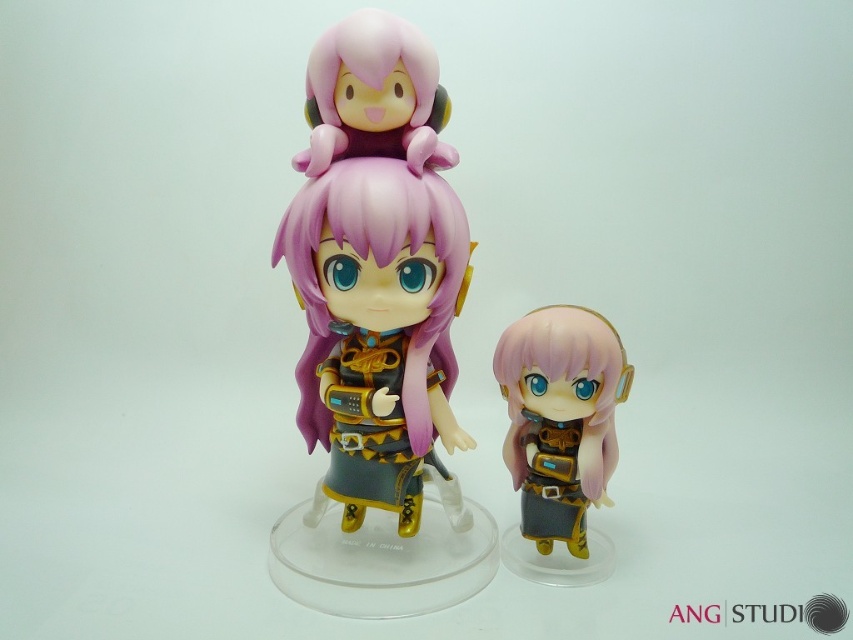
Does matte black figure at center have a greater width compared to purple matte hair at center?

Incorrect, matte black figure at center's width does not surpass purple matte hair at center's.

Between point (627, 380) and point (386, 227), which one is positioned behind?

The point (627, 380) is behind.

Where is `matte black figure at center`? The width and height of the screenshot is (853, 640). matte black figure at center is located at coordinates (560, 436).